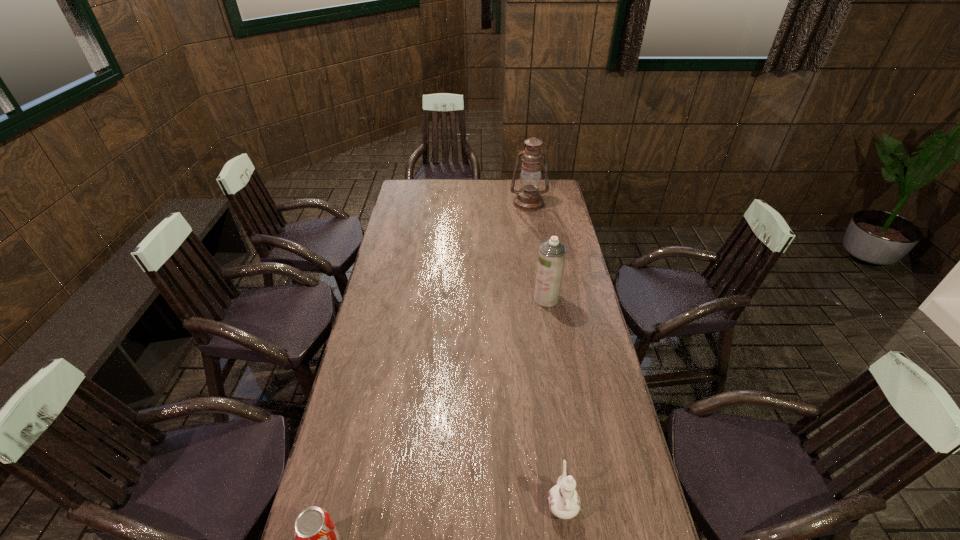
Where is `free spot between the second nearest object and the oil lamp`? Image resolution: width=960 pixels, height=540 pixels. free spot between the second nearest object and the oil lamp is located at coordinates (545, 353).

At what (x,y) coordinates should I click in order to perform the action: click on object that ranks as the closest to the nearest object. Please return your answer as a coordinate pair (x, y). The height and width of the screenshot is (540, 960). Looking at the image, I should click on (563, 500).

I want to click on the closest object relative to the third farthest object, so click(x=316, y=538).

Where is `vacant space that satisfies the following two spatial constraints: 1. at the spout of the oil lamp; 2. on the left side of the second nearest object`? vacant space that satisfies the following two spatial constraints: 1. at the spout of the oil lamp; 2. on the left side of the second nearest object is located at coordinates (521, 203).